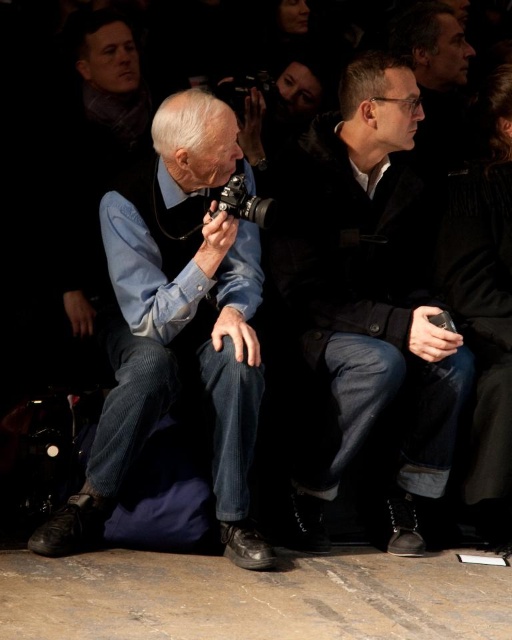
Between point (465, 256) and point (238, 196), which one is positioned behind?

Point (465, 256)

Locate an element on the screen. denim jeans at center is located at coordinates (484, 301).

Which is behind, point (112, 444) or point (508, 451)?

Positioned behind is point (508, 451).

Between point (211, 337) and point (454, 198), which one is positioned behind?

Point (454, 198)

Locate an element on the screen. The width and height of the screenshot is (512, 640). matte black camera at center is located at coordinates (178, 324).

Can you confirm if matte black camera at center is shorter than silver metallic camera at center?

No.

Where is `matte black camera at center`? The width and height of the screenshot is (512, 640). matte black camera at center is located at coordinates [x=178, y=324].

Which is behind, point (200, 166) or point (232, 212)?

The point (232, 212) is more distant.

At what (x,y) coordinates should I click in order to perform the action: click on matte black camera at center. Please return your answer as a coordinate pair (x, y). The height and width of the screenshot is (640, 512). Looking at the image, I should click on (178, 324).